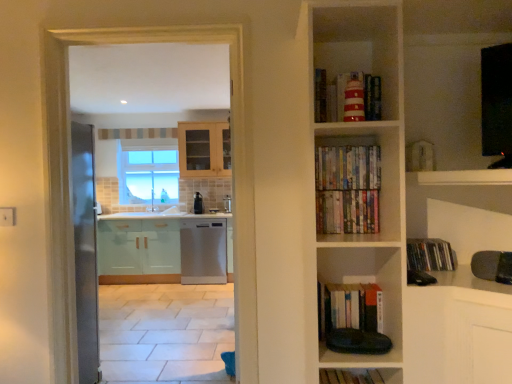
At what (x,y) coordinates should I click in order to perform the action: click on blank area beneath multicolored paperbacks at center, the second book in the top-to-bottom sequence (from a real-world perspective). Please return your answer as a coordinate pair (x, y). This screenshot has width=512, height=384. Looking at the image, I should click on (343, 194).